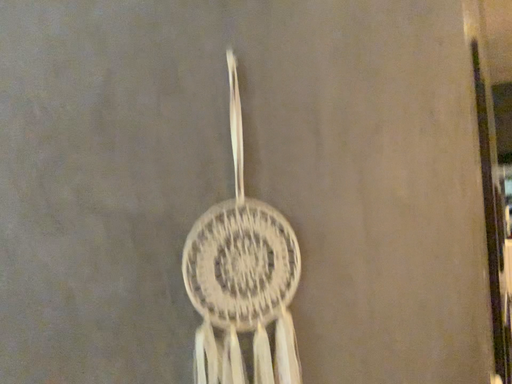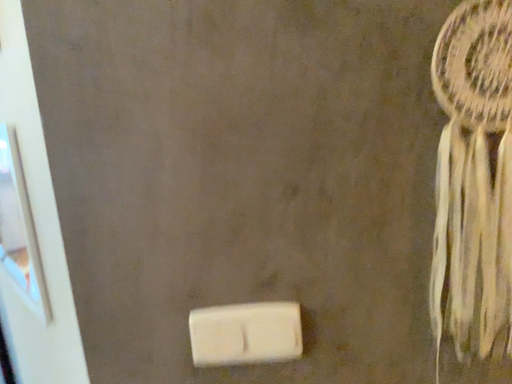
Question: Which way did the camera rotate in the video?

Choices:
 (A) rotated right
 (B) rotated left

Answer: (B)